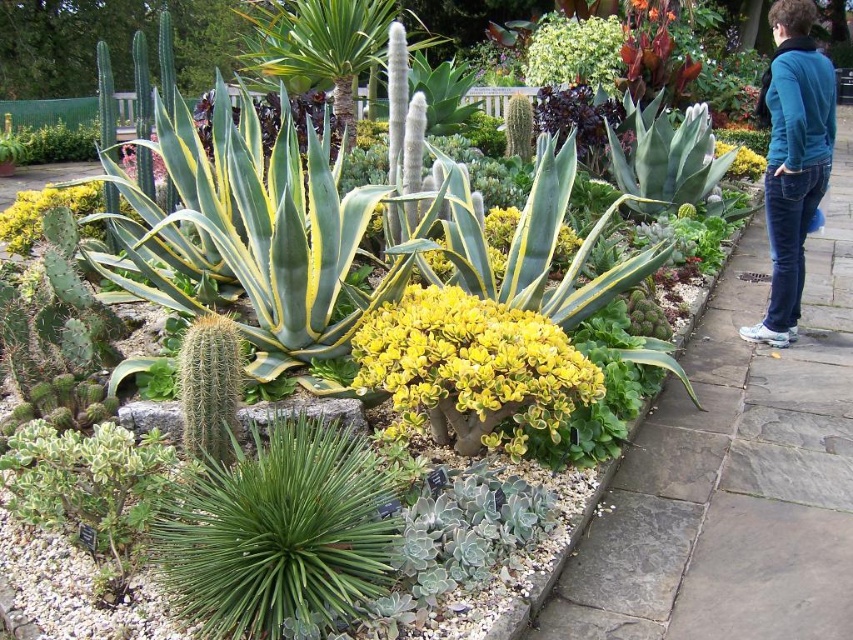
At what (x,y) coordinates should I click in order to perform the action: click on gray stone pavement at lower right. Please return your answer as a coordinate pair (x, y). The width and height of the screenshot is (853, 640). Looking at the image, I should click on (735, 472).

Is gray stone pavement at lower right to the left of teal fleece jacket at upper right from the viewer's perspective?

Yes, gray stone pavement at lower right is to the left of teal fleece jacket at upper right.

Does point (824, 259) come behind point (790, 125)?

Yes, point (824, 259) is farther from viewer.

Identify the location of gray stone pavement at lower right. This screenshot has width=853, height=640. click(x=735, y=472).

Between gray stone pavement at lower right and yellow matte flower at center, which one has less height?

With less height is gray stone pavement at lower right.

Where is `gray stone pavement at lower right`? The height and width of the screenshot is (640, 853). gray stone pavement at lower right is located at coordinates (735, 472).

Between point (798, 118) and point (759, 170), which one is positioned behind?

The point (759, 170) is behind.

Looking at this image, who is shorter, teal fleece jacket at upper right or yellow matte flower at center?

Standing shorter between the two is yellow matte flower at center.

The width and height of the screenshot is (853, 640). In order to click on teal fleece jacket at upper right in this screenshot , I will do `click(792, 160)`.